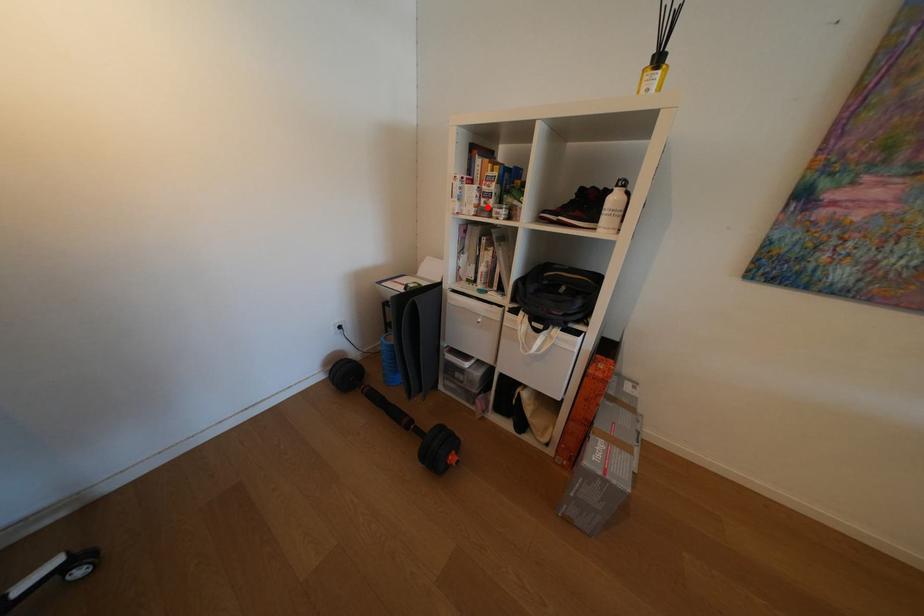
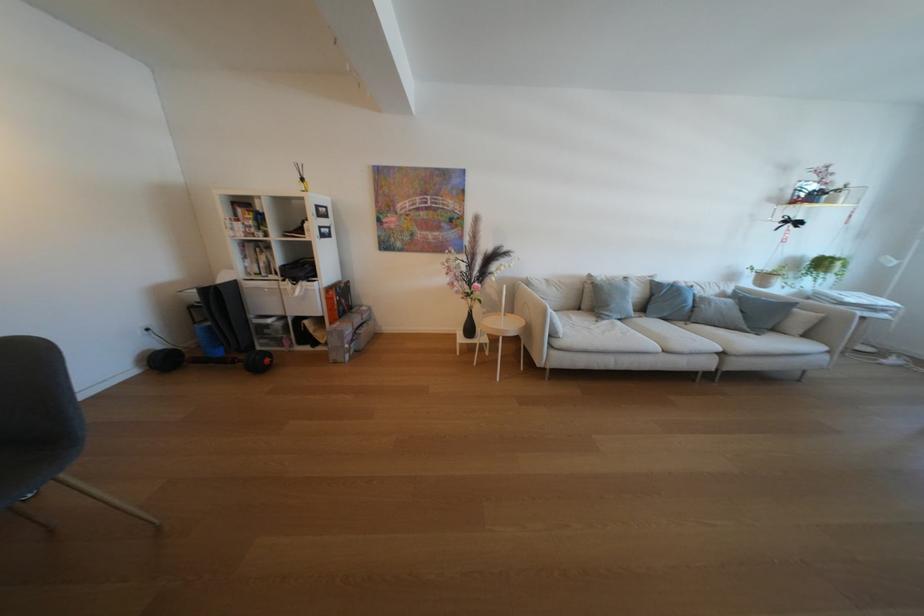
Where in the second image is the point corresponding to the highlighted location from the first image?

(256, 233)